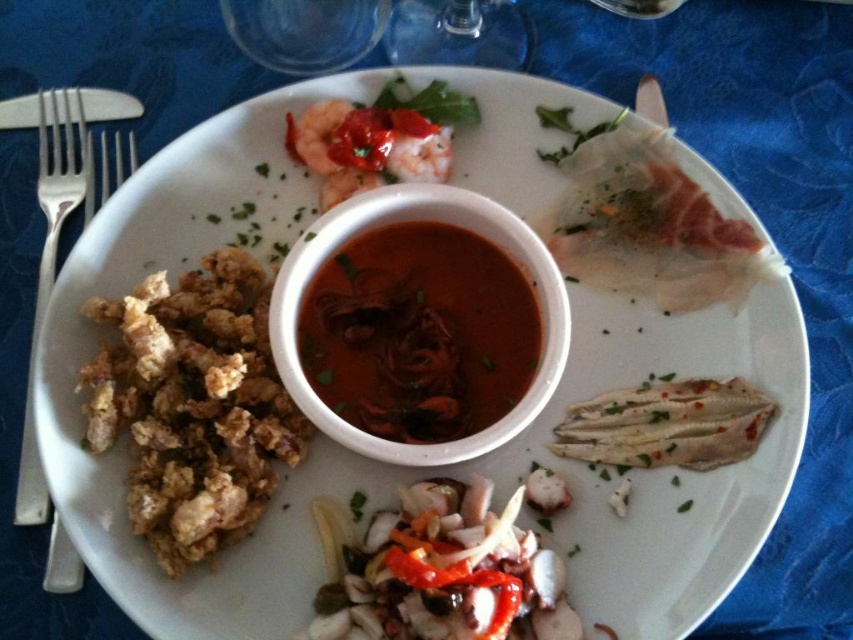
Can you confirm if white flaky fish at lower right is positioned to the left of silver metallic fork at left?

In fact, white flaky fish at lower right is to the right of silver metallic fork at left.

Does white flaky fish at lower right appear under silver metallic fork at left?

Correct, white flaky fish at lower right is located below silver metallic fork at left.

Is point (606, 404) positioned in front of point (82, 214)?

That is True.

Where is `white flaky fish at lower right`? white flaky fish at lower right is located at coordinates (666, 424).

Is slightly translucent squid at center to the left of silver metallic fork at left from the viewer's perspective?

In fact, slightly translucent squid at center is to the right of silver metallic fork at left.

Which is behind, point (556, 492) or point (45, 564)?

The point (556, 492) is behind.

Where is `slightly translucent squid at center`? slightly translucent squid at center is located at coordinates (445, 573).

Image resolution: width=853 pixels, height=640 pixels. Find the location of `brown crispy fried food at left`. brown crispy fried food at left is located at coordinates (193, 404).

Between brown crispy fried food at left and dark red glossy sauce at center, which one is positioned lower?

brown crispy fried food at left is below.

This screenshot has width=853, height=640. I want to click on brown crispy fried food at left, so click(x=193, y=404).

The width and height of the screenshot is (853, 640). Identify the location of brown crispy fried food at left. (193, 404).